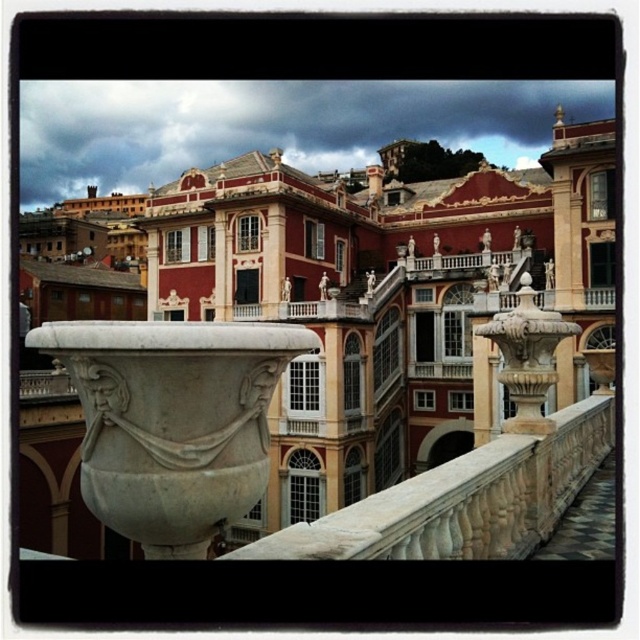
Question: Among these points, which one is farthest from the camera?

Choices:
 (A) (38, 348)
 (B) (282, 244)
 (C) (518, 486)

Answer: (B)

Question: Is matte stone palace at center to the left of white stone railing at center from the viewer's perspective?

Choices:
 (A) yes
 (B) no

Answer: (A)

Question: Is matte stone palace at center bigger than white stone railing at center?

Choices:
 (A) no
 (B) yes

Answer: (B)

Question: Does matte stone palace at center have a greater width compared to white stone railing at center?

Choices:
 (A) yes
 (B) no

Answer: (A)

Question: Which point appears farthest from the camera in this image?

Choices:
 (A) (289, 531)
 (B) (262, 492)

Answer: (A)

Question: Which of the following is the closest to the observer?

Choices:
 (A) (332, 522)
 (B) (97, 460)

Answer: (B)